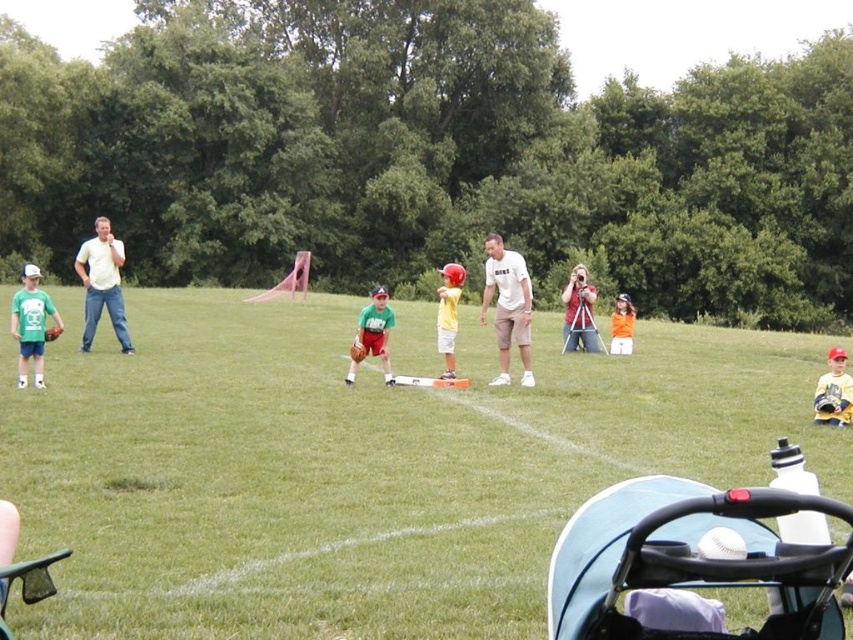
You are a photographer holding the matte white camera at center. You want to take a photo of the green matte baseball glove at center. Since both are at the center, how can you adjust your position to frame the glove properly?

The green matte baseball glove at center is wider than the matte white camera at center. To frame the glove properly, move the camera closer to the glove so that the entire glove fits within the camera frame.

You are standing at the center of the field and see the point marked at coordinates (x=32, y=324). What object is located at that point?

The point at coordinates (x=32, y=324) marks the matte green tshirt at left.